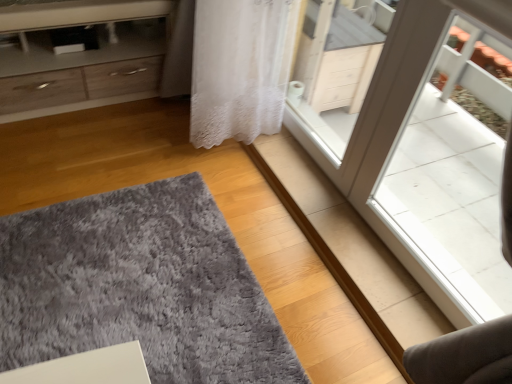
Question: From the image's perspective, is gray shaggy rug at lower left beneath matte wood chest of drawers at upper left?

Choices:
 (A) yes
 (B) no

Answer: (A)

Question: Can you see gray shaggy rug at lower left touching matte wood chest of drawers at upper left?

Choices:
 (A) yes
 (B) no

Answer: (B)

Question: Could you tell me if gray shaggy rug at lower left is facing matte wood chest of drawers at upper left?

Choices:
 (A) no
 (B) yes

Answer: (A)

Question: Considering the relative positions of gray shaggy rug at lower left and matte wood chest of drawers at upper left in the image provided, is gray shaggy rug at lower left to the left of matte wood chest of drawers at upper left from the viewer's perspective?

Choices:
 (A) yes
 (B) no

Answer: (B)

Question: From a real-world perspective, is gray shaggy rug at lower left beneath matte wood chest of drawers at upper left?

Choices:
 (A) yes
 (B) no

Answer: (A)

Question: Does gray shaggy rug at lower left appear on the right side of matte wood chest of drawers at upper left?

Choices:
 (A) yes
 (B) no

Answer: (A)

Question: Can you confirm if matte wood chest of drawers at upper left is positioned to the left of gray shaggy rug at lower left?

Choices:
 (A) no
 (B) yes

Answer: (B)

Question: Is the depth of matte wood chest of drawers at upper left greater than that of gray shaggy rug at lower left?

Choices:
 (A) no
 (B) yes

Answer: (B)

Question: From a real-world perspective, is matte wood chest of drawers at upper left under gray shaggy rug at lower left?

Choices:
 (A) no
 (B) yes

Answer: (A)

Question: Would you say matte wood chest of drawers at upper left is outside gray shaggy rug at lower left?

Choices:
 (A) no
 (B) yes

Answer: (B)

Question: Is gray shaggy rug at lower left at the back of matte wood chest of drawers at upper left?

Choices:
 (A) no
 (B) yes

Answer: (A)

Question: Is matte wood chest of drawers at upper left at the right side of gray shaggy rug at lower left?

Choices:
 (A) yes
 (B) no

Answer: (B)

Question: In terms of width, does matte wood chest of drawers at upper left look wider or thinner when compared to gray shaggy rug at lower left?

Choices:
 (A) thin
 (B) wide

Answer: (A)